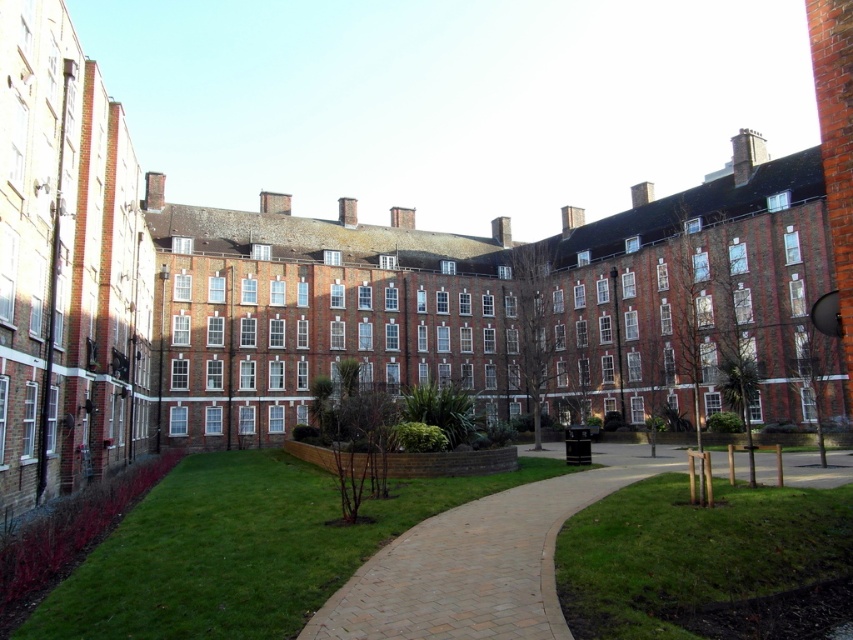
Question: Is green grass at lower left bigger than green grass at lower right?

Choices:
 (A) no
 (B) yes

Answer: (B)

Question: Which point is farther to the camera?

Choices:
 (A) (248, 612)
 (B) (631, 531)

Answer: (B)

Question: Does green grass at lower left have a smaller size compared to green grass at lower right?

Choices:
 (A) yes
 (B) no

Answer: (B)

Question: Can you confirm if green grass at lower left is thinner than green grass at lower right?

Choices:
 (A) yes
 (B) no

Answer: (B)

Question: Which point is farther from the camera taking this photo?

Choices:
 (A) (247, 580)
 (B) (798, 486)

Answer: (B)

Question: Which point is farther to the camera?

Choices:
 (A) green grass at lower left
 (B) green grass at lower right

Answer: (B)